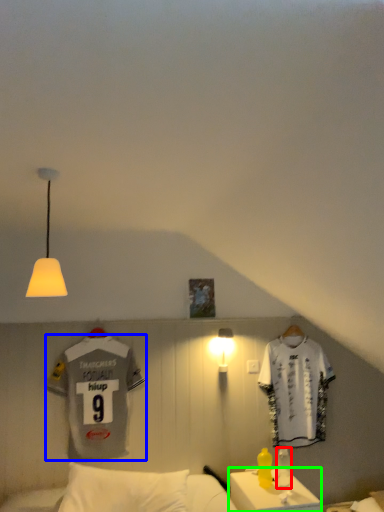
Question: Based on their relative distances, which object is nearer to bottle (highlighted by a red box)? Choose from sports uniform (highlighted by a blue box) and table (highlighted by a green box).

Choices:
 (A) sports uniform
 (B) table

Answer: (B)